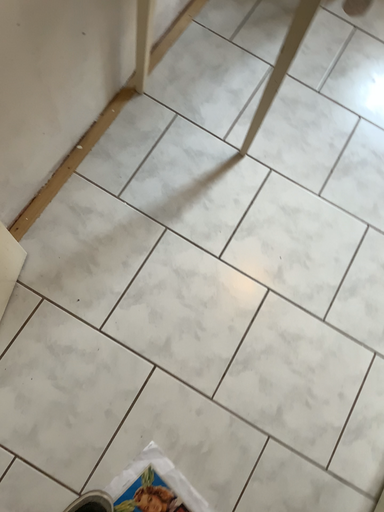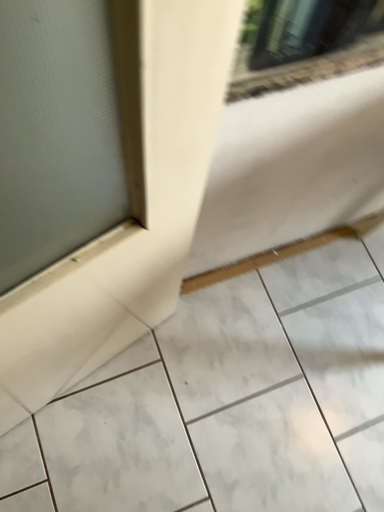
Question: How did the camera likely rotate when shooting the video?

Choices:
 (A) rotated right
 (B) rotated left

Answer: (B)